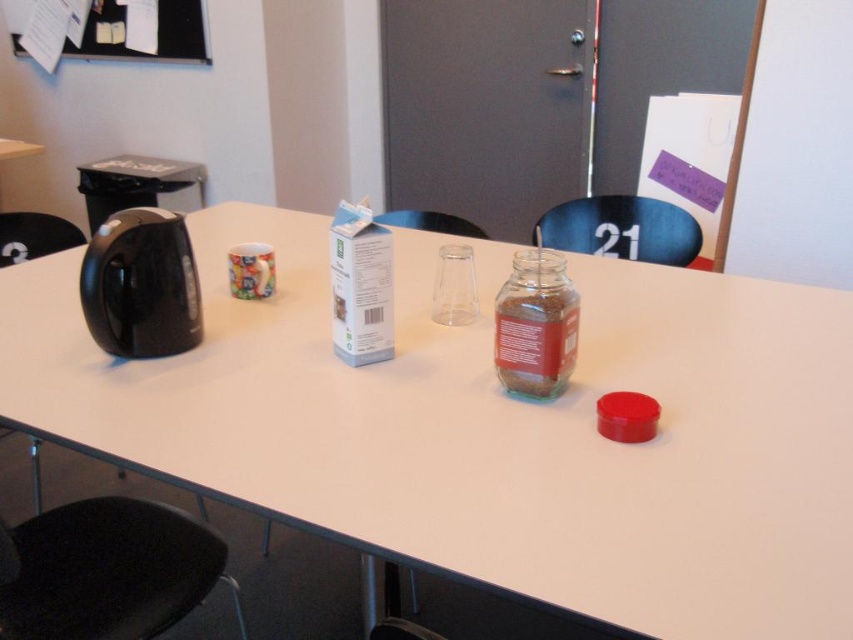
You are planning to place a large document folder on the white glossy table at center. Considering the size of the table compared to the black plastic chair at lower left, will the folder fit on the table?

The white glossy table at center is larger in size than the black plastic chair at lower left, so the document folder should fit on the table since it is bigger than the chair.

You are standing at the entrance of the room and want to sit down. The black plastic chair at lower left is your only option. Where exactly should you move to in order to sit on it?

The black plastic chair at lower left is located at the coordinates point (105,570), so you should move to that exact point to sit on it.